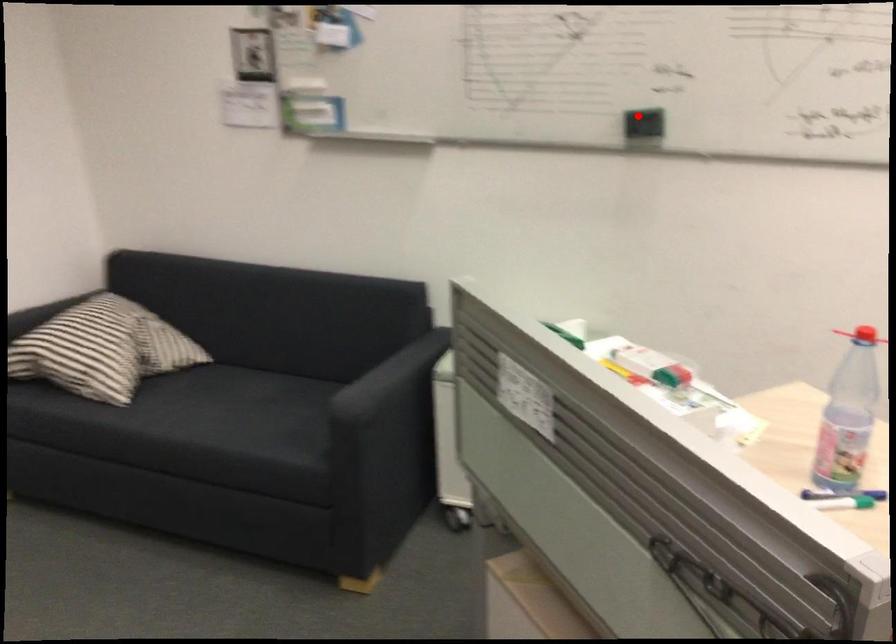
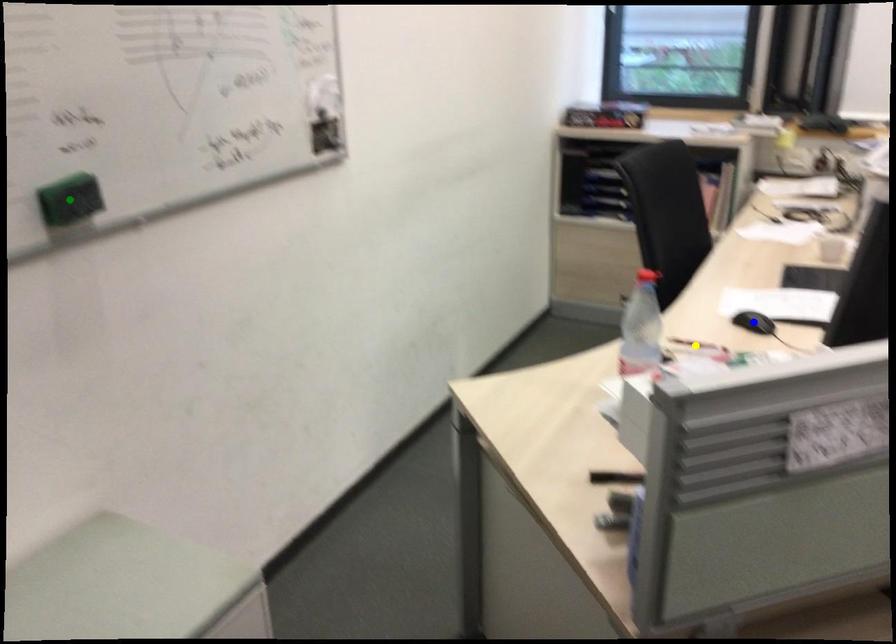
Question: I am providing you with two images of the same scene from different viewpoints. A red point is marked on the first image. You are given multiple points on the second image. Which point in image 2 represents the same 3d spot as the red point in image 1?

Choices:
 (A) blue point
 (B) green point
 (C) yellow point

Answer: (B)